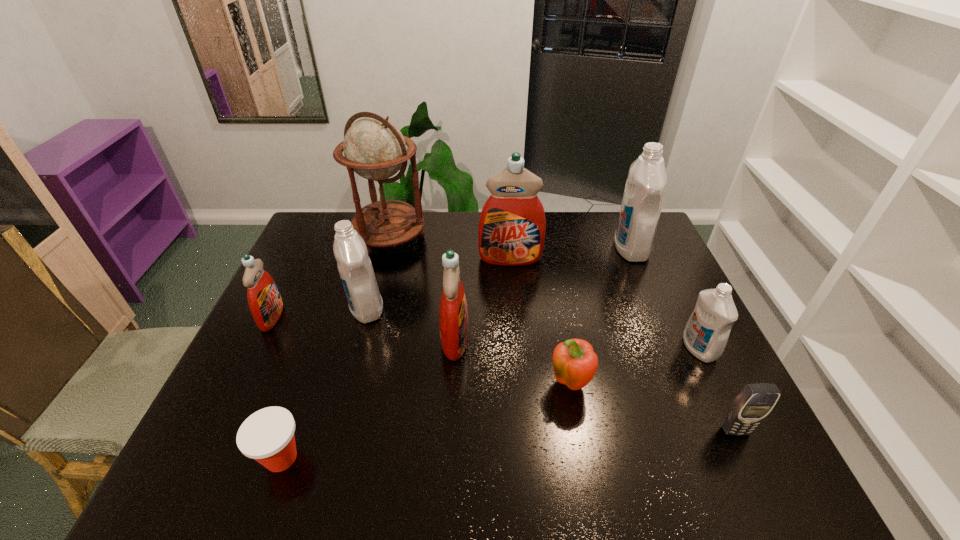
The height and width of the screenshot is (540, 960). I want to click on the leftmost detergent, so click(x=265, y=303).

Locate an element on the screen. This screenshot has width=960, height=540. pepper is located at coordinates (575, 363).

Identify the location of orange pepper. This screenshot has width=960, height=540. (575, 363).

Find the location of `cellular telephone`. cellular telephone is located at coordinates (752, 405).

Find the location of a particular element. Dixie cup is located at coordinates (267, 436).

Locate an element on the screen. The height and width of the screenshot is (540, 960). the shortest object is located at coordinates pyautogui.click(x=267, y=436).

The height and width of the screenshot is (540, 960). What are the coordinates of `free space located 0.350m on the surface of the tallest object` in the screenshot? It's located at (362, 340).

Where is `free space located on the front of the biggest white detergent`? free space located on the front of the biggest white detergent is located at coordinates (668, 336).

Find the location of a particular element. The width and height of the screenshot is (960, 540). vacant space located 0.180m on the front surface of the biggest red detergent is located at coordinates (515, 306).

Locate an element on the screen. vacant space situated 0.080m on the front of the second detergent from left to right is located at coordinates (355, 348).